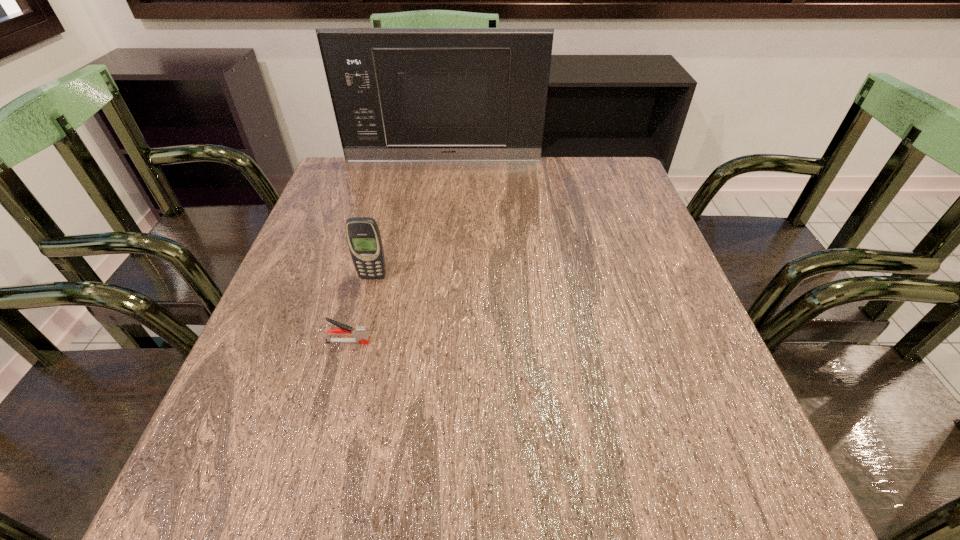
Where is `vacant space at the near right corner`? The image size is (960, 540). vacant space at the near right corner is located at coordinates (710, 463).

Find the location of `free space between the tallest object and the nearest object`. free space between the tallest object and the nearest object is located at coordinates (396, 251).

Find the location of a particular element. free space between the nearest object and the second nearest object is located at coordinates (360, 309).

This screenshot has height=540, width=960. I want to click on vacant space that's between the cellular telephone and the nearest object, so click(x=360, y=309).

Find the location of a particular element. This screenshot has height=540, width=960. blank region between the second farthest object and the stapler is located at coordinates (360, 309).

This screenshot has height=540, width=960. I want to click on free space between the shortest object and the farthest object, so click(396, 251).

This screenshot has width=960, height=540. In order to click on vacant point located between the tallest object and the cellular telephone in this screenshot , I will do `click(408, 219)`.

What are the coordinates of `free space between the nearest object and the second nearest object` in the screenshot? It's located at (360, 309).

Locate an element on the screen. The width and height of the screenshot is (960, 540). free space between the stapler and the farthest object is located at coordinates (396, 251).

This screenshot has width=960, height=540. What are the coordinates of `vacant area that lies between the stapler and the second nearest object` in the screenshot? It's located at (360, 309).